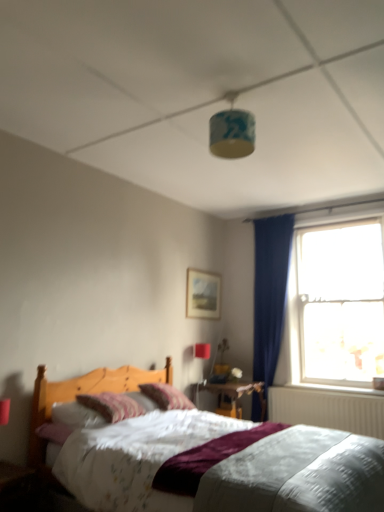
Question: Can you confirm if transparent glass window at right is thinner than wooden nightstand at center?

Choices:
 (A) no
 (B) yes

Answer: (B)

Question: From the image's perspective, is transparent glass window at right on wooden nightstand at center?

Choices:
 (A) no
 (B) yes

Answer: (B)

Question: Is the surface of transparent glass window at right in direct contact with wooden nightstand at center?

Choices:
 (A) no
 (B) yes

Answer: (A)

Question: Considering the relative positions of transparent glass window at right and wooden nightstand at center in the image provided, is transparent glass window at right to the right of wooden nightstand at center from the viewer's perspective?

Choices:
 (A) no
 (B) yes

Answer: (B)

Question: Is transparent glass window at right oriented away from wooden nightstand at center?

Choices:
 (A) yes
 (B) no

Answer: (B)

Question: Is transparent glass window at right shorter than wooden nightstand at center?

Choices:
 (A) yes
 (B) no

Answer: (B)

Question: Is striped fabric pillow at center, which is the 1th pillow from front to back, oriented away from velvet purple pillow at center, the 2th pillow in the front-to-back sequence?

Choices:
 (A) yes
 (B) no

Answer: (B)

Question: Could you tell me if striped fabric pillow at center, the second pillow when ordered from back to front, is facing velvet purple pillow at center, which is counted as the 1th pillow, starting from the back?

Choices:
 (A) no
 (B) yes

Answer: (A)

Question: Are striped fabric pillow at center, which is the 1th pillow from front to back, and velvet purple pillow at center, which is counted as the 1th pillow, starting from the back, located far from each other?

Choices:
 (A) yes
 (B) no

Answer: (B)

Question: Is striped fabric pillow at center, the second pillow when ordered from back to front, with velvet purple pillow at center, which is counted as the 1th pillow, starting from the back?

Choices:
 (A) no
 (B) yes

Answer: (A)

Question: Does striped fabric pillow at center, the second pillow when ordered from back to front, come behind velvet purple pillow at center, which is counted as the 1th pillow, starting from the back?

Choices:
 (A) no
 (B) yes

Answer: (A)

Question: From a real-world perspective, is striped fabric pillow at center, the second pillow when ordered from back to front, physically below velvet purple pillow at center, the 2th pillow in the front-to-back sequence?

Choices:
 (A) no
 (B) yes

Answer: (A)

Question: Can you confirm if white glossy window sill at lower right is positioned to the left of transparent glass window at right?

Choices:
 (A) no
 (B) yes

Answer: (B)